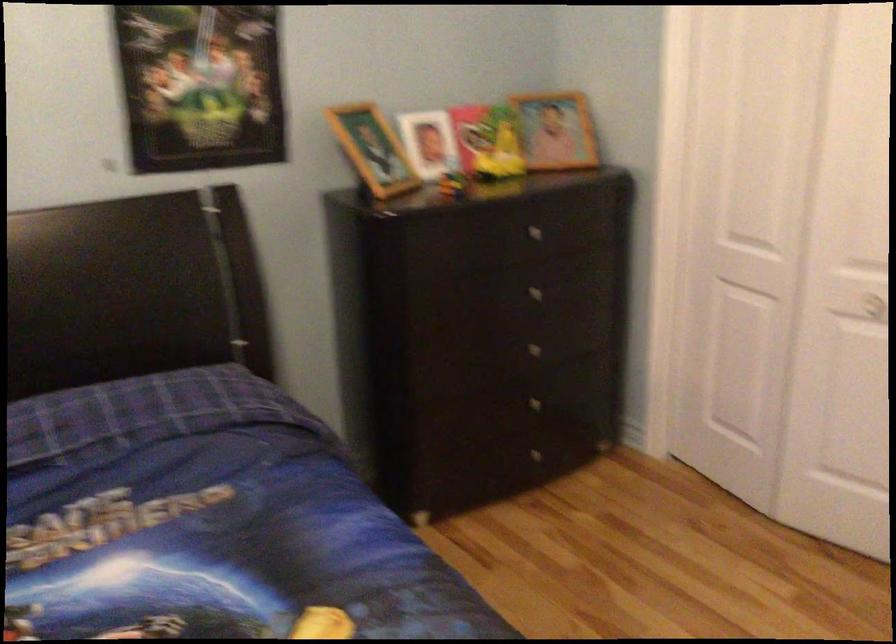
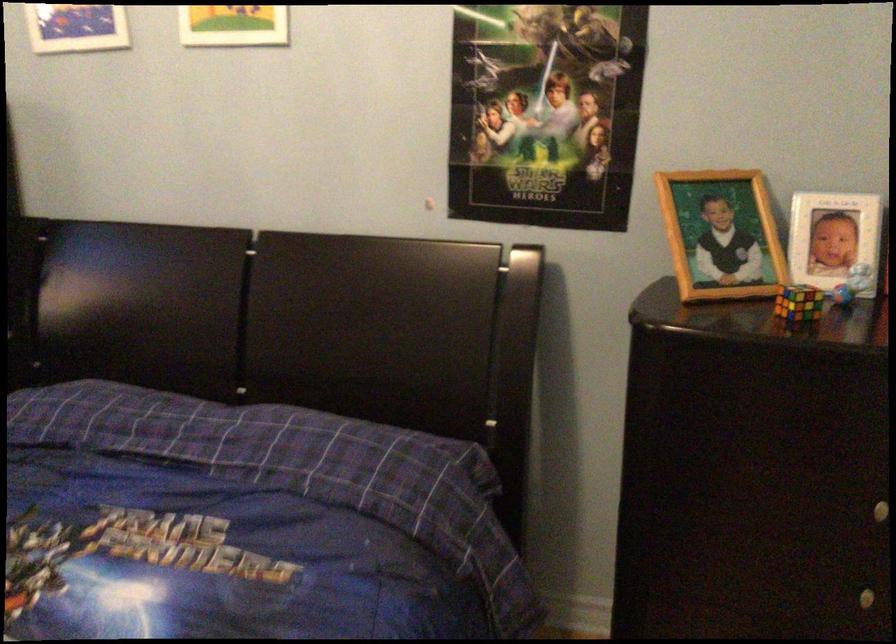
The point at (371, 144) is marked in the first image. Where is the corresponding point in the second image?

(720, 234)